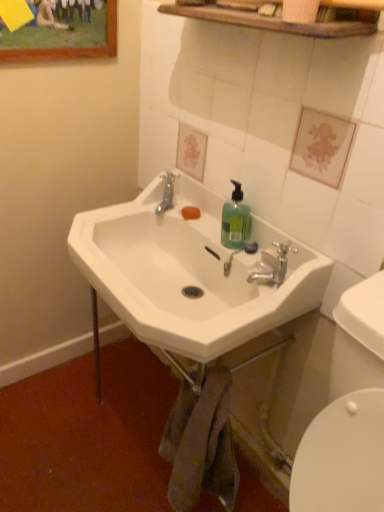
Locate an element on the screen. This screenshot has width=384, height=512. white ceramic sink at center is located at coordinates (189, 273).

You are a GUI agent. You are given a task and a screenshot of the screen. Output one action in this format:
    pyautogui.click(x=<x>, y=<y>)
    Task: Click on the translucent green liquid at sink right
    
    Given the screenshot: What is the action you would take?
    pyautogui.click(x=235, y=220)

The image size is (384, 512). What do you see at coordinates (58, 30) in the screenshot?
I see `wooden framed painting at upper left` at bounding box center [58, 30].

Image resolution: width=384 pixels, height=512 pixels. Find the location of `white ceramic sink at center`. white ceramic sink at center is located at coordinates (189, 273).

Is translucent green liquid at sink right at the left side of silver metallic faucet at upper center, marked as the 1th plumbing fixture in a back-to-front arrangement?

No, translucent green liquid at sink right is not to the left of silver metallic faucet at upper center, marked as the 1th plumbing fixture in a back-to-front arrangement.

Considering the sizes of translucent green liquid at sink right and silver metallic faucet at upper center, marked as the 1th plumbing fixture in a back-to-front arrangement, in the image, is translucent green liquid at sink right wider or thinner than silver metallic faucet at upper center, marked as the 1th plumbing fixture in a back-to-front arrangement,?

In the image, translucent green liquid at sink right appears to be more narrow than silver metallic faucet at upper center, marked as the 1th plumbing fixture in a back-to-front arrangement.

The image size is (384, 512). Find the location of `plumbing fixture on the left of the translucent green liquid at sink right`. plumbing fixture on the left of the translucent green liquid at sink right is located at coordinates (167, 193).

Is translucent green liquid at sink right aimed at silver metallic faucet at upper center, which is the 2th plumbing fixture from front to back?

No, translucent green liquid at sink right is not facing towards silver metallic faucet at upper center, which is the 2th plumbing fixture from front to back.

Is translucent green liquid at sink right not close to metallic silver faucet at lower center, the second plumbing fixture viewed from the left?

No.

Between translucent green liquid at sink right and metallic silver faucet at lower center, the first plumbing fixture from the right, which one has smaller width?

With smaller width is metallic silver faucet at lower center, the first plumbing fixture from the right.

Considering the relative positions of translucent green liquid at sink right and metallic silver faucet at lower center, positioned as the 1th plumbing fixture in bottom-to-top order, in the image provided, is translucent green liquid at sink right to the left of metallic silver faucet at lower center, positioned as the 1th plumbing fixture in bottom-to-top order, from the viewer's perspective?

Yes.

Considering the relative sizes of wooden framed painting at upper left and translucent green liquid at sink right in the image provided, is wooden framed painting at upper left shorter than translucent green liquid at sink right?

No.

From a real-world perspective, is wooden framed painting at upper left under translucent green liquid at sink right?

No, from a real-world perspective, wooden framed painting at upper left is not below translucent green liquid at sink right.

Considering the positions of objects wooden framed painting at upper left and translucent green liquid at sink right in the image provided, who is more to the right, wooden framed painting at upper left or translucent green liquid at sink right?

Positioned to the right is translucent green liquid at sink right.

Considering the sizes of wooden framed painting at upper left and translucent green liquid at sink right in the image, is wooden framed painting at upper left wider or thinner than translucent green liquid at sink right?

wooden framed painting at upper left is thinner than translucent green liquid at sink right.

Could you tell me if white ceramic sink at center is facing translucent green liquid at sink right?

No, white ceramic sink at center is not turned towards translucent green liquid at sink right.

Between white ceramic sink at center and translucent green liquid at sink right, which one has smaller width?

Thinner between the two is translucent green liquid at sink right.

Which is less distant, (196,294) or (230,232)?

The point (230,232) is closer to the camera.

Which of these two, white ceramic sink at center or translucent green liquid at sink right, stands taller?

Standing taller between the two is white ceramic sink at center.

Can you confirm if silver metallic faucet at upper center, the second plumbing fixture when ordered from right to left, is shorter than wooden framed painting at upper left?

Yes.

Does silver metallic faucet at upper center, marked as the 1th plumbing fixture in a back-to-front arrangement, have a smaller size compared to wooden framed painting at upper left?

Yes, silver metallic faucet at upper center, marked as the 1th plumbing fixture in a back-to-front arrangement, is smaller than wooden framed painting at upper left.

Between silver metallic faucet at upper center, which is the 2th plumbing fixture from front to back, and wooden framed painting at upper left, which one appears on the left side from the viewer's perspective?

wooden framed painting at upper left is more to the left.

Considering the sizes of silver metallic faucet at upper center, the 1th plumbing fixture in the left-to-right sequence, and wooden framed painting at upper left in the image, is silver metallic faucet at upper center, the 1th plumbing fixture in the left-to-right sequence, wider or thinner than wooden framed painting at upper left?

In the image, silver metallic faucet at upper center, the 1th plumbing fixture in the left-to-right sequence, appears to be wider than wooden framed painting at upper left.

From a real-world perspective, is wooden framed painting at upper left positioned under silver metallic faucet at upper center, which ranks as the first plumbing fixture in top-to-bottom order, based on gravity?

No, from a real-world perspective, wooden framed painting at upper left is not beneath silver metallic faucet at upper center, which ranks as the first plumbing fixture in top-to-bottom order.

Is wooden framed painting at upper left bigger or smaller than silver metallic faucet at upper center, which ranks as the first plumbing fixture in top-to-bottom order?

In the image, wooden framed painting at upper left appears to be larger than silver metallic faucet at upper center, which ranks as the first plumbing fixture in top-to-bottom order.

Would you say wooden framed painting at upper left contains silver metallic faucet at upper center, marked as the 1th plumbing fixture in a back-to-front arrangement?

Definitely not — silver metallic faucet at upper center, marked as the 1th plumbing fixture in a back-to-front arrangement, is not inside wooden framed painting at upper left.

Considering the positions of objects wooden framed painting at upper left and silver metallic faucet at upper center, which ranks as the first plumbing fixture in top-to-bottom order, in the image provided, who is in front, wooden framed painting at upper left or silver metallic faucet at upper center, which ranks as the first plumbing fixture in top-to-bottom order,?

wooden framed painting at upper left is closer to the camera.

Is wooden framed painting at upper left far away from white ceramic sink at center?

They are positioned close to each other.

Does wooden framed painting at upper left come in front of white ceramic sink at center?

No, it is behind white ceramic sink at center.

Which is closer to the camera, (91, 6) or (189, 298)?

Clearly, point (91, 6) is more distant from the camera than point (189, 298).

Which of these two, wooden framed painting at upper left or white ceramic sink at center, is smaller?

Smaller between the two is wooden framed painting at upper left.

Identify the location of plumbing fixture above the translucent green liquid at sink right (from the image's perspective). (167, 193).

Find the location of `plumbing fixture on the right of translucent green liquid at sink right`. plumbing fixture on the right of translucent green liquid at sink right is located at coordinates (273, 265).

Based on their spatial positions, is silver metallic faucet at upper center, which is the 2th plumbing fixture from front to back, or white ceramic sink at center closer to translucent green liquid at sink right?

white ceramic sink at center is positioned closer to the anchor translucent green liquid at sink right.

When comparing their distances from translucent green liquid at sink right, does wooden framed painting at upper left or metallic silver faucet at lower center, which appears as the 2th plumbing fixture when viewed from the top, seem further?

wooden framed painting at upper left lies further to translucent green liquid at sink right than the other object.

When comparing their distances from metallic silver faucet at lower center, the 1th plumbing fixture viewed from the front, does translucent green liquid at sink right or wooden framed painting at upper left seem closer?

translucent green liquid at sink right is closer to metallic silver faucet at lower center, the 1th plumbing fixture viewed from the front.

Looking at the image, which one is located closer to wooden framed painting at upper left, metallic silver faucet at lower center, which is the 2th plumbing fixture from back to front, or white ceramic sink at center?

white ceramic sink at center is positioned closer to the anchor wooden framed painting at upper left.

From the picture: Estimate the real-world distances between objects in this image. Which object is further from translucent green liquid at sink right, white ceramic sink at center or silver metallic faucet at upper center, which appears as the second plumbing fixture when ordered from the bottom?

silver metallic faucet at upper center, which appears as the second plumbing fixture when ordered from the bottom.

Looking at the image, which one is located closer to metallic silver faucet at lower center, the second plumbing fixture viewed from the left, silver metallic faucet at upper center, the 1th plumbing fixture in the left-to-right sequence, or white ceramic sink at center?

Among the two, white ceramic sink at center is located nearer to metallic silver faucet at lower center, the second plumbing fixture viewed from the left.

Considering their positions, is metallic silver faucet at lower center, the first plumbing fixture from the right, positioned further to translucent green liquid at sink right than wooden framed painting at upper left?

Based on the image, wooden framed painting at upper left appears to be further to translucent green liquid at sink right.

Estimate the real-world distances between objects in this image. Which object is closer to metallic silver faucet at lower center, positioned as the 1th plumbing fixture in bottom-to-top order, translucent green liquid at sink right or silver metallic faucet at upper center, marked as the 1th plumbing fixture in a back-to-front arrangement?

translucent green liquid at sink right.

The height and width of the screenshot is (512, 384). Identify the location of plumbing fixture located between white ceramic sink at center and silver metallic faucet at upper center, the second plumbing fixture when ordered from right to left, in the depth direction. (273, 265).

Image resolution: width=384 pixels, height=512 pixels. Find the location of `bottle between wooden framed painting at upper left and white ceramic sink at center vertically`. bottle between wooden framed painting at upper left and white ceramic sink at center vertically is located at coordinates (235, 220).

The height and width of the screenshot is (512, 384). Find the location of `plumbing fixture between white ceramic sink at center and translucent green liquid at sink right from front to back`. plumbing fixture between white ceramic sink at center and translucent green liquid at sink right from front to back is located at coordinates (273, 265).

The image size is (384, 512). Find the location of `bottle between metallic silver faucet at lower center, which appears as the 2th plumbing fixture when viewed from the top, and silver metallic faucet at upper center, which is the 2th plumbing fixture from front to back, along the z-axis`. bottle between metallic silver faucet at lower center, which appears as the 2th plumbing fixture when viewed from the top, and silver metallic faucet at upper center, which is the 2th plumbing fixture from front to back, along the z-axis is located at coordinates (235, 220).